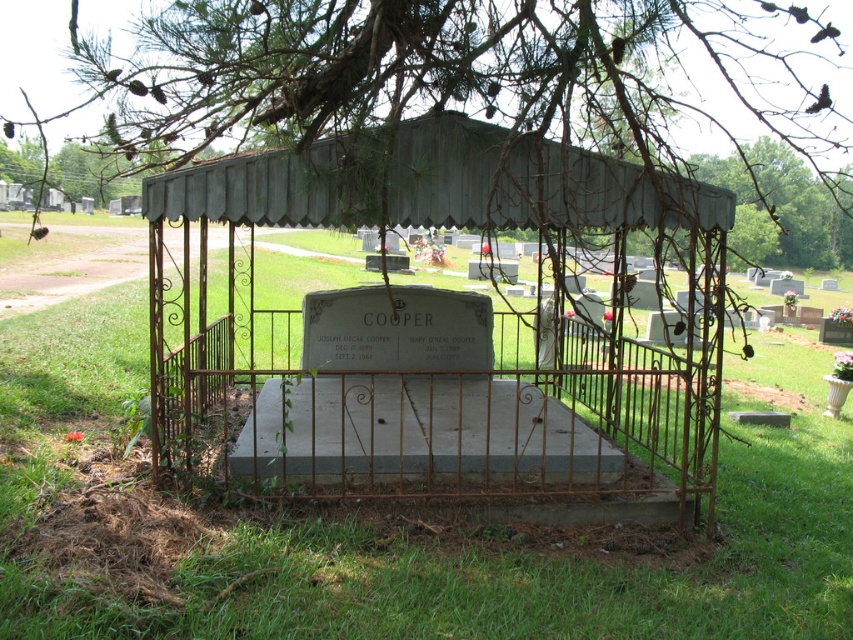
Based on the photo, based on the provided image, what are the exact coordinates of the green leafy tree at upper center?

The green leafy tree at upper center is located at coordinates [480,84].

You are a maintenance worker inspecting the cemetery. You notice the rusty metal gazebo at center and the metallic gray canopy at center. Which structure is taller?

The rusty metal gazebo at center is much taller than the metallic gray canopy at center.